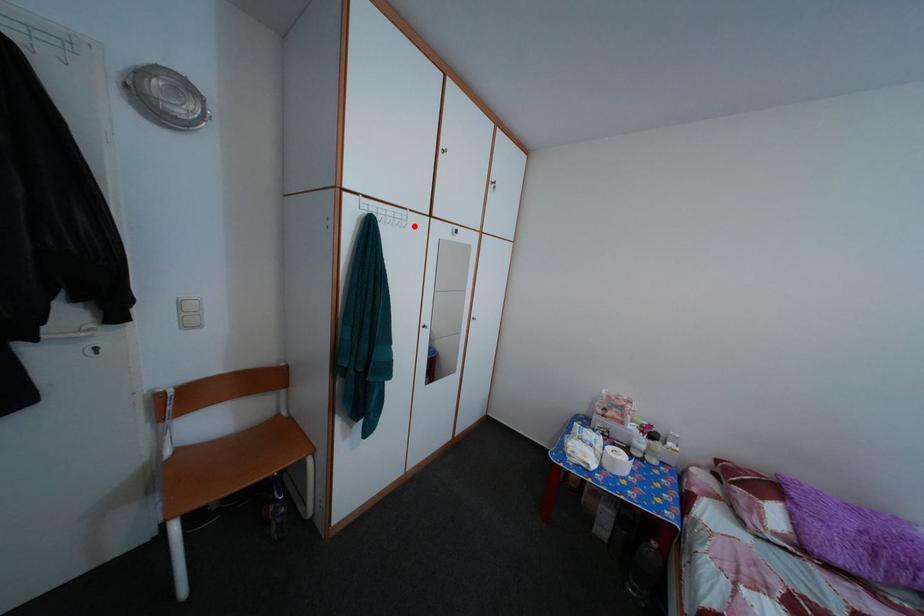
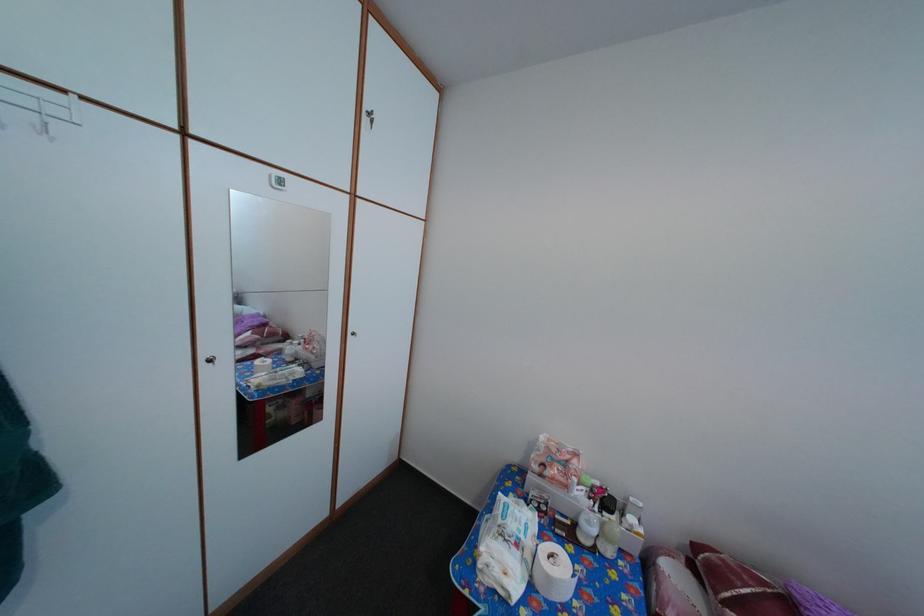
In the second image, find the point that corresponds to the highlighted location in the first image.

(66, 120)